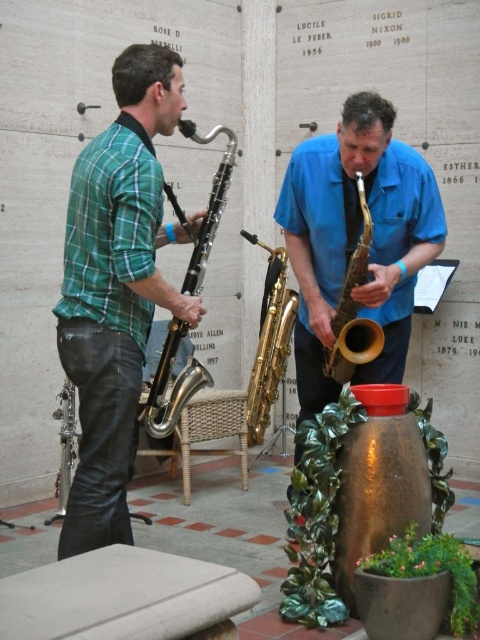
In the scene shown: Can you confirm if blue glossy saxophone at center is positioned to the left of metallic silver saxophone at left?

In fact, blue glossy saxophone at center is to the right of metallic silver saxophone at left.

Does blue glossy saxophone at center have a greater width compared to metallic silver saxophone at left?

Yes, blue glossy saxophone at center is wider than metallic silver saxophone at left.

Is point (388, 166) positioned after point (216, 218)?

Yes.

Locate an element on the screen. The image size is (480, 640). blue glossy saxophone at center is located at coordinates (x=357, y=240).

Is green plaid shirt at left positioned before gold brass saxophone at center?

That is True.

Is green plaid shirt at left thinner than gold brass saxophone at center?

No, green plaid shirt at left is not thinner than gold brass saxophone at center.

Is point (141, 60) in front of point (288, 326)?

Yes.

The image size is (480, 640). In order to click on green plaid shirt at left in this screenshot , I will do (x=116, y=289).

Is green plaid shirt at left shorter than metallic silver saxophone at left?

Incorrect, green plaid shirt at left's height does not fall short of metallic silver saxophone at left's.

Between point (97, 220) and point (214, 216), which one is positioned in front?

Point (97, 220) is more forward.

What do you see at coordinates (116, 289) in the screenshot? I see `green plaid shirt at left` at bounding box center [116, 289].

The image size is (480, 640). In order to click on green plaid shirt at left in this screenshot , I will do `click(116, 289)`.